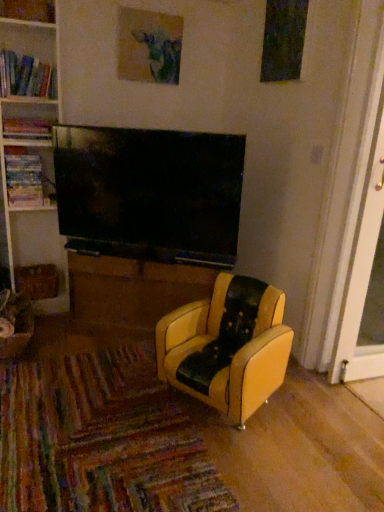
You are a GUI agent. You are given a task and a screenshot of the screen. Output one action in this format:
    pyautogui.click(x=<x>, y=<y>)
    Task: Click on the free space in front of yellow leather chair at center
    The width and height of the screenshot is (384, 512).
    Given the screenshot: What is the action you would take?
    pyautogui.click(x=282, y=470)